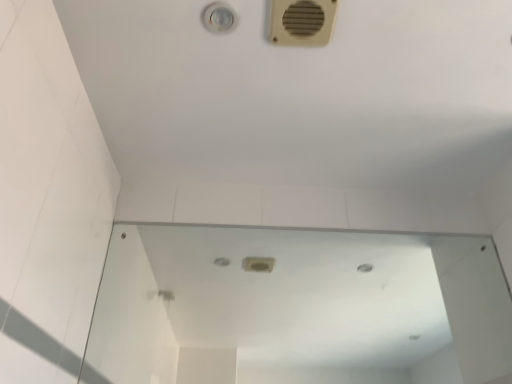
Where is `beige plastic air conditioning at upper right`? The image size is (512, 384). beige plastic air conditioning at upper right is located at coordinates (302, 22).

Image resolution: width=512 pixels, height=384 pixels. What do you see at coordinates (302, 22) in the screenshot?
I see `beige plastic air conditioning at upper right` at bounding box center [302, 22].

This screenshot has width=512, height=384. In order to click on transparent glass mirror at center in this screenshot , I will do `click(298, 308)`.

What do you see at coordinates (298, 308) in the screenshot?
I see `transparent glass mirror at center` at bounding box center [298, 308].

You are a GUI agent. You are given a task and a screenshot of the screen. Output one action in this format:
    pyautogui.click(x=<x>, y=<y>)
    Task: Click on the beige plastic air conditioning at upper right
    The width and height of the screenshot is (512, 384).
    Given the screenshot: What is the action you would take?
    pyautogui.click(x=302, y=22)

Which object is positioned more to the right, transparent glass mirror at center or beige plastic air conditioning at upper right?

From the viewer's perspective, transparent glass mirror at center appears more on the right side.

Does transparent glass mirror at center come behind beige plastic air conditioning at upper right?

Yes, it is.

Does point (281, 329) appear closer or farther from the camera than point (336, 6)?

Clearly, point (281, 329) is more distant from the camera than point (336, 6).

From the image's perspective, is transparent glass mirror at center on beige plastic air conditioning at upper right?

No, from the image's perspective, transparent glass mirror at center is not above beige plastic air conditioning at upper right.

From a real-world perspective, is transparent glass mirror at center located higher than beige plastic air conditioning at upper right?

Actually, transparent glass mirror at center is physically below beige plastic air conditioning at upper right in the real world.

Considering the sizes of objects transparent glass mirror at center and beige plastic air conditioning at upper right in the image provided, who is wider, transparent glass mirror at center or beige plastic air conditioning at upper right?

With larger width is beige plastic air conditioning at upper right.

Can you confirm if transparent glass mirror at center is shorter than beige plastic air conditioning at upper right?

No.

Looking at this image, which of these two, transparent glass mirror at center or beige plastic air conditioning at upper right, is bigger?

transparent glass mirror at center is bigger.

Is transparent glass mirror at center not inside beige plastic air conditioning at upper right?

Yes.

Is transparent glass mirror at center not close to beige plastic air conditioning at upper right?

Indeed, transparent glass mirror at center is not near beige plastic air conditioning at upper right.

Is transparent glass mirror at center aimed at beige plastic air conditioning at upper right?

Yes.

The height and width of the screenshot is (384, 512). What are the coordinates of `mirror beneath the beige plastic air conditioning at upper right (from a real-world perspective)` in the screenshot? It's located at (298, 308).

Is beige plastic air conditioning at upper right at the right side of transparent glass mirror at center?

No.

In the image, is beige plastic air conditioning at upper right positioned in front of or behind transparent glass mirror at center?

Visually, beige plastic air conditioning at upper right is located in front of transparent glass mirror at center.

Does point (318, 17) come behind point (468, 295)?

No.

From the image's perspective, which is above, beige plastic air conditioning at upper right or transparent glass mirror at center?

beige plastic air conditioning at upper right.

From a real-world perspective, is beige plastic air conditioning at upper right positioned over transparent glass mirror at center based on gravity?

Indeed, from a real-world perspective, beige plastic air conditioning at upper right stands above transparent glass mirror at center.

Which object is wider, beige plastic air conditioning at upper right or transparent glass mirror at center?

With larger width is beige plastic air conditioning at upper right.

Is beige plastic air conditioning at upper right taller or shorter than transparent glass mirror at center?

Considering their sizes, beige plastic air conditioning at upper right has less height than transparent glass mirror at center.

In the scene shown: Considering the relative sizes of beige plastic air conditioning at upper right and transparent glass mirror at center in the image provided, is beige plastic air conditioning at upper right smaller than transparent glass mirror at center?

Yes, beige plastic air conditioning at upper right is smaller than transparent glass mirror at center.

In the scene shown: Can we say beige plastic air conditioning at upper right lies outside transparent glass mirror at center?

Yes, beige plastic air conditioning at upper right is located beyond the bounds of transparent glass mirror at center.

Is beige plastic air conditioning at upper right next to transparent glass mirror at center?

No, beige plastic air conditioning at upper right is not touching transparent glass mirror at center.

Does beige plastic air conditioning at upper right turn towards transparent glass mirror at center?

No, beige plastic air conditioning at upper right is not turned towards transparent glass mirror at center.

How many degrees apart are the facing directions of beige plastic air conditioning at upper right and transparent glass mirror at center?

There is a 1.69-degree angle between the facing directions of beige plastic air conditioning at upper right and transparent glass mirror at center.

Identify the location of air conditioning above the transparent glass mirror at center (from a real-world perspective). The image size is (512, 384). (302, 22).

The height and width of the screenshot is (384, 512). I want to click on mirror below the beige plastic air conditioning at upper right (from the image's perspective), so click(x=298, y=308).

Locate an element on the screen. air conditioning located on the left of transparent glass mirror at center is located at coordinates (302, 22).